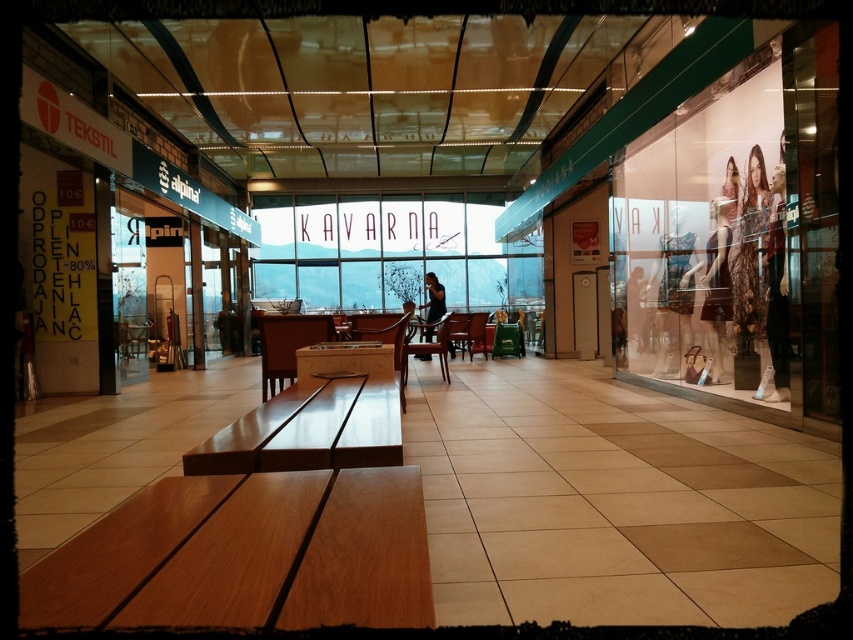
Question: Among these points, which one is farthest from the camera?

Choices:
 (A) (343, 236)
 (B) (398, 524)

Answer: (A)

Question: Is wooden bench at lower left below transparent glass sign at center?

Choices:
 (A) no
 (B) yes

Answer: (B)

Question: Is wooden bench at lower left above black dress at center?

Choices:
 (A) yes
 (B) no

Answer: (B)

Question: Which point appears closest to the camera in this image?

Choices:
 (A) (299, 550)
 (B) (331, 298)
 (C) (437, 308)

Answer: (A)

Question: Does shiny brown bench at center have a smaller size compared to black dress at center?

Choices:
 (A) yes
 (B) no

Answer: (A)

Question: Which object appears closest to the camera in this image?

Choices:
 (A) wooden bench at lower left
 (B) transparent glass sign at center
 (C) shiny brown bench at center

Answer: (A)